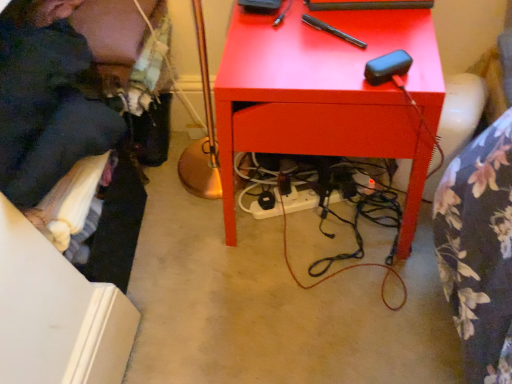
Identify the location of free spot above matte red desk at center (from a real-world perspective). (318, 31).